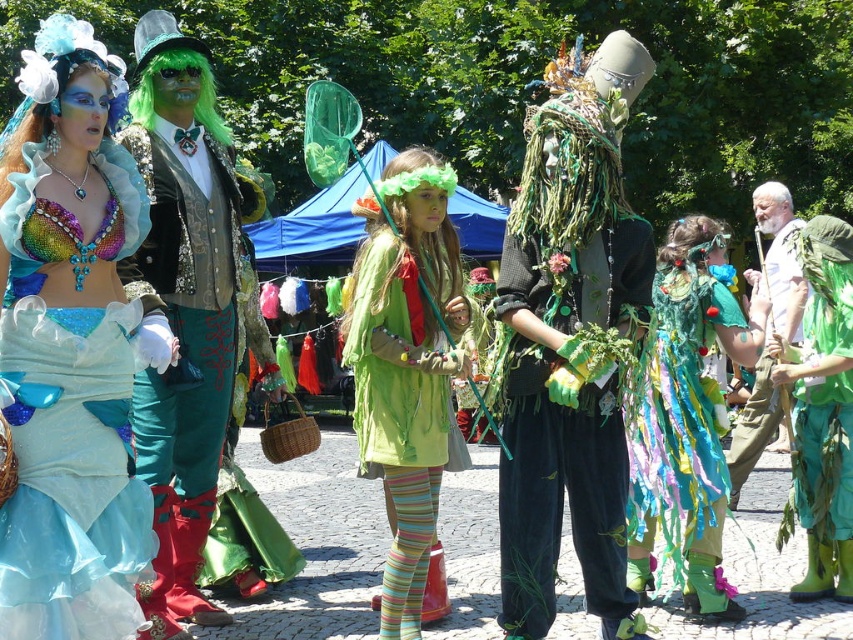
Question: Does velvet green gloves at center appear under shiny teal fabric dress at center?

Choices:
 (A) yes
 (B) no

Answer: (B)

Question: Does velvet green gloves at center appear on the right side of green fabric dress at center?

Choices:
 (A) yes
 (B) no

Answer: (A)

Question: Considering the real-world distances, which object is farthest from the green fabric dress at center?

Choices:
 (A) shiny green fabric pants at left
 (B) shiny sequin top at left
 (C) velvet green gloves at center
 (D) shiny teal fabric dress at center

Answer: (D)

Question: Estimate the real-world distances between objects in this image. Which object is closer to the velvet green gloves at center?

Choices:
 (A) shiny sequin top at left
 (B) shiny teal fabric dress at center

Answer: (B)

Question: Which point is closer to the camera taking this photo?

Choices:
 (A) (611, 312)
 (B) (428, 429)
 (C) (167, 605)
 (D) (720, 344)

Answer: (B)

Question: Can you confirm if shiny green fabric pants at left is positioned to the right of velvet green gloves at center?

Choices:
 (A) yes
 (B) no

Answer: (B)